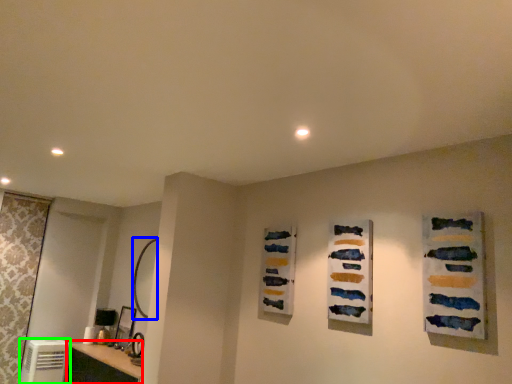
Question: Based on their relative distances, which object is nearer to vanity (highlighted by a red box)? Choose from mirror (highlighted by a blue box) and appliance (highlighted by a green box).

Choices:
 (A) mirror
 (B) appliance

Answer: (B)